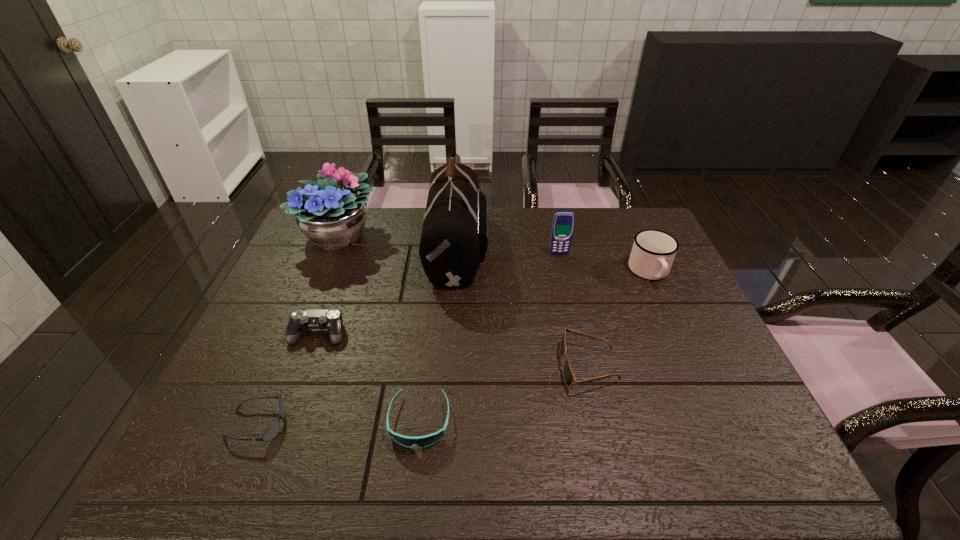
Where is `duffel bag that is at the far edge`? The width and height of the screenshot is (960, 540). duffel bag that is at the far edge is located at coordinates (454, 239).

Locate an element on the screen. This screenshot has width=960, height=540. bouquet that is at the far edge is located at coordinates (330, 212).

I want to click on bouquet that is at the left edge, so click(330, 212).

Where is `control that is at the left edge`? control that is at the left edge is located at coordinates (331, 319).

At what (x,y) coordinates should I click in order to perform the action: click on sunglasses at the left edge. Please return your answer as a coordinate pair (x, y). The height and width of the screenshot is (540, 960). Looking at the image, I should click on (272, 432).

Image resolution: width=960 pixels, height=540 pixels. Identify the location of object situated at the right edge. (653, 251).

Identify the location of object situated at the far left corner. The height and width of the screenshot is (540, 960). (330, 212).

Find the location of a particular element. The image size is (960, 540). object present at the near left corner is located at coordinates (272, 432).

At what (x,y) coordinates should I click in order to perform the action: click on vacant space at the far edge of the desktop. Please return your answer as a coordinate pair (x, y). Looking at the image, I should click on (382, 219).

Identify the location of free space at the near edge of the desktop. coord(516,471).